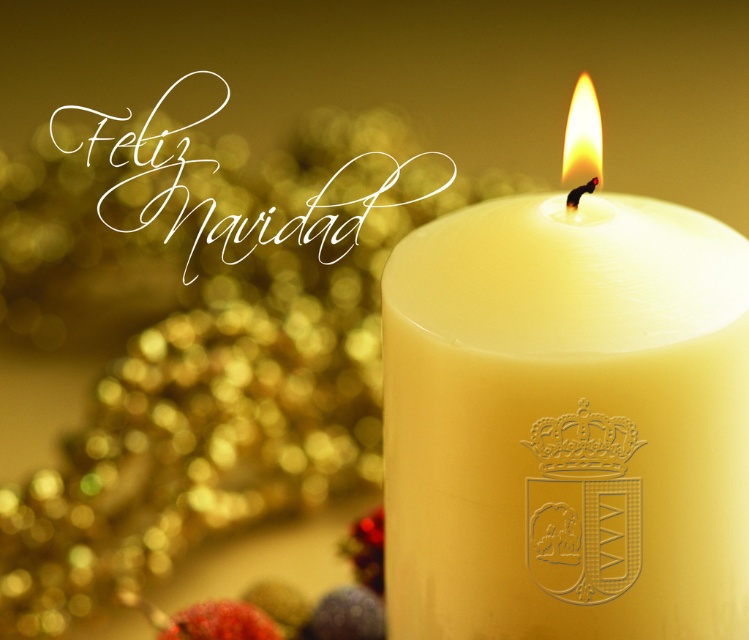
You are an interior designer planning to place a decorative item on a shelf. You see the point marked at coordinates (565, 422) in the image. What object is located at that point?

The point at coordinates (565, 422) corresponds to the white wax candle at center.